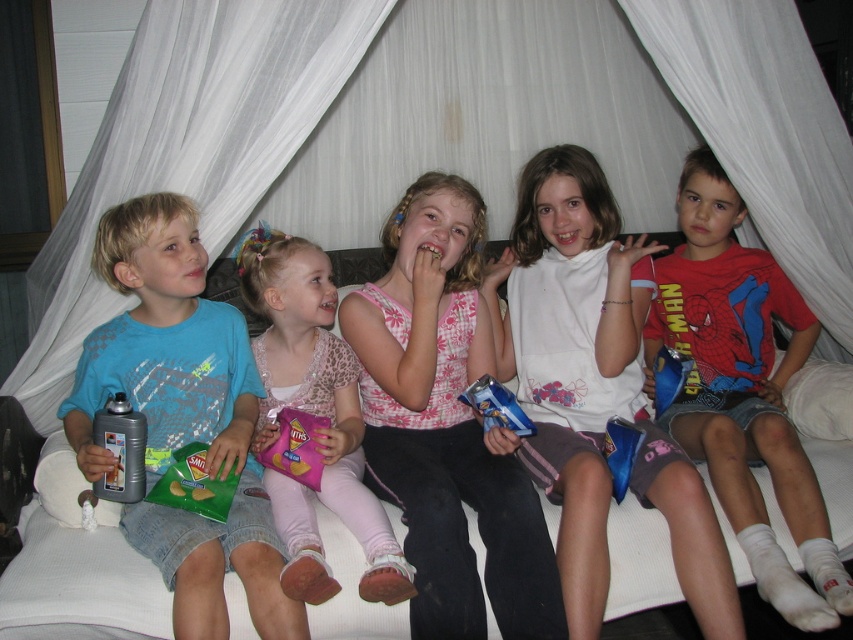
Between pink floral tank top at center and pink floral shirt at center, which one has more height?

Standing taller between the two is pink floral tank top at center.

Can you confirm if pink floral tank top at center is positioned below pink floral shirt at center?

Incorrect, pink floral tank top at center is not positioned below pink floral shirt at center.

Is point (445, 488) farther from camera compared to point (271, 310)?

No, (445, 488) is in front of (271, 310).

This screenshot has width=853, height=640. In order to click on pink floral tank top at center in this screenshot , I will do `click(445, 424)`.

The height and width of the screenshot is (640, 853). Describe the element at coordinates (183, 416) in the screenshot. I see `matte blue t-shirt at left` at that location.

Does matte blue t-shirt at left appear on the right side of pink floral shirt at center?

In fact, matte blue t-shirt at left is to the left of pink floral shirt at center.

Image resolution: width=853 pixels, height=640 pixels. I want to click on matte blue t-shirt at left, so click(x=183, y=416).

You are a GUI agent. You are given a task and a screenshot of the screen. Output one action in this format:
    pyautogui.click(x=<x>, y=<y>)
    Task: Click on the matte blue t-shirt at left
    The image size is (853, 640).
    Given the screenshot: What is the action you would take?
    pyautogui.click(x=183, y=416)

Does matte white shirt at center appear over matte blue t-shirt at left?

Correct, matte white shirt at center is located above matte blue t-shirt at left.

Is matte white shirt at center further to the viewer compared to matte blue t-shirt at left?

Yes, matte white shirt at center is further from the viewer.

Identify the location of matte white shirt at center. The height and width of the screenshot is (640, 853). (595, 387).